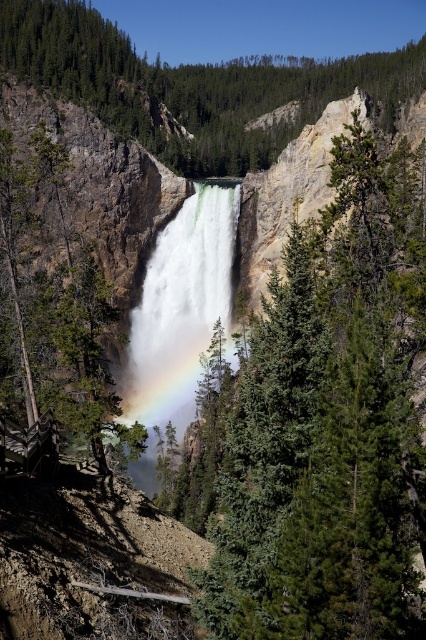
Who is shorter, green matte tree at center or brown wooden log cabin at lower left?

brown wooden log cabin at lower left is shorter.

Is green matte tree at center positioned before brown wooden log cabin at lower left?

Yes, it is.

Identify the location of green matte tree at center. (328, 424).

Where is `green matte tree at center`? The height and width of the screenshot is (640, 426). green matte tree at center is located at coordinates (328, 424).

Is green matte tree at left below brown wooden log cabin at lower left?

Incorrect, green matte tree at left is not positioned below brown wooden log cabin at lower left.

Who is shorter, green matte tree at left or brown wooden log cabin at lower left?

With less height is brown wooden log cabin at lower left.

Find the location of a particular element. This screenshot has width=426, height=640. green matte tree at left is located at coordinates (48, 308).

Is green matte tree at left to the left of white frothy water at center from the viewer's perspective?

Yes, green matte tree at left is to the left of white frothy water at center.

Can you confirm if green matte tree at left is positioned above white frothy water at center?

Indeed, green matte tree at left is positioned over white frothy water at center.

Which is behind, point (51, 408) or point (190, 198)?

Point (190, 198)

The image size is (426, 640). I want to click on green matte tree at left, so click(48, 308).